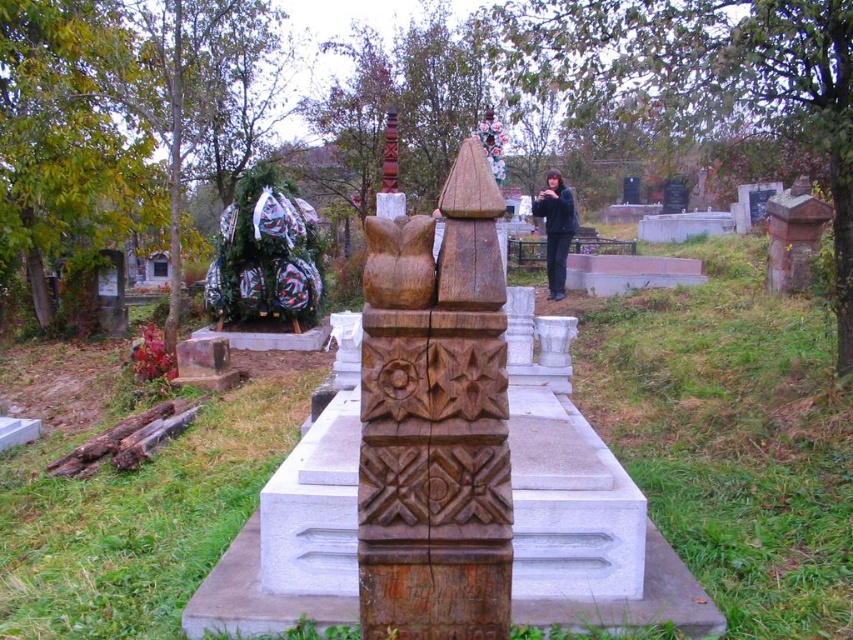
Question: Is wooden carving at center smaller than brown wood totem pole at center?

Choices:
 (A) no
 (B) yes

Answer: (A)

Question: Can you confirm if green fabric sculpture at left is positioned to the right of black matte jacket at center?

Choices:
 (A) no
 (B) yes

Answer: (A)

Question: Is wooden carving at center wider than brown wood carving at center?

Choices:
 (A) yes
 (B) no

Answer: (A)

Question: Among these objects, which one is farthest from the camera?

Choices:
 (A) brown wood totem pole at center
 (B) black matte jacket at center
 (C) green fabric sculpture at left
 (D) brown wood carving at center

Answer: (B)

Question: Considering the real-world distances, which object is closest to the wooden carving at center?

Choices:
 (A) black matte jacket at center
 (B) brown wood totem pole at center
 (C) brown wood carving at center

Answer: (C)

Question: Which point is farther to the camera?

Choices:
 (A) black matte jacket at center
 (B) brown wood carving at center
 (C) brown wood totem pole at center

Answer: (A)